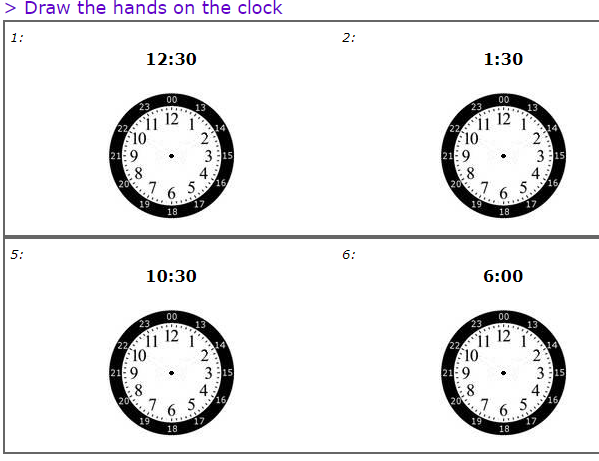
Where is `clock faces`? The width and height of the screenshot is (599, 461). clock faces is located at coordinates (181, 141), (513, 141), (186, 365), (504, 362).